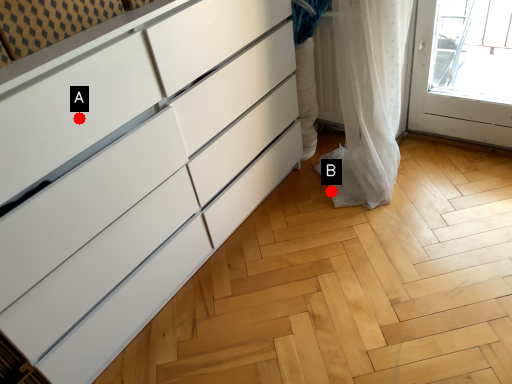
Question: Two points are circled on the image, labeled by A and B beside each circle. Which point is farther from the camera taking this photo?

Choices:
 (A) A is further
 (B) B is further

Answer: (B)